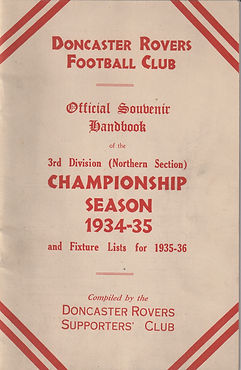
The width and height of the screenshot is (241, 370). Find the location of `corners`. corners is located at coordinates (228, 356), (10, 355), (229, 12), (16, 8).